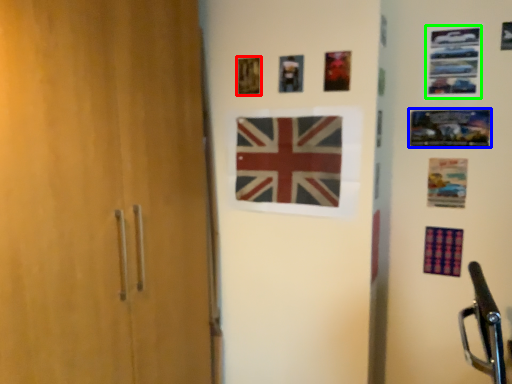
Question: Based on their relative distances, which object is nearer to picture frame (highlighted by a red box)? Choose from picture frame (highlighted by a blue box) and picture frame (highlighted by a green box).

Choices:
 (A) picture frame
 (B) picture frame

Answer: (B)